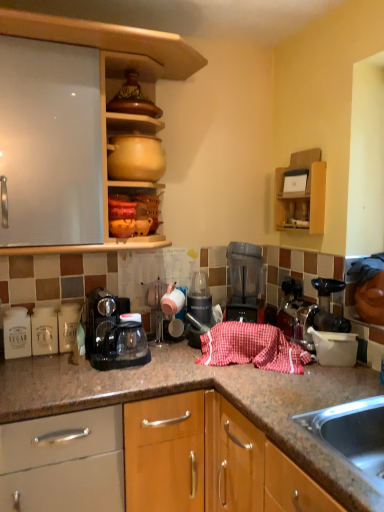
Question: Should I look upward or downward to see black plastic blender at center, the first appliance from the bottom?

Choices:
 (A) up
 (B) down

Answer: (B)

Question: Is the depth of matte yellow clay pot at upper center, which is the 2th appliance in back-to-front order, less than that of red checkered cloth at center?

Choices:
 (A) no
 (B) yes

Answer: (A)

Question: Is matte yellow clay pot at upper center, placed as the 1th appliance when sorted from left to right, thinner than red checkered cloth at center?

Choices:
 (A) no
 (B) yes

Answer: (A)

Question: Can you confirm if matte yellow clay pot at upper center, the first appliance positioned from the top, is positioned to the right of red checkered cloth at center?

Choices:
 (A) no
 (B) yes

Answer: (A)

Question: Does matte yellow clay pot at upper center, the second appliance when ordered from right to left, have a smaller size compared to red checkered cloth at center?

Choices:
 (A) no
 (B) yes

Answer: (B)

Question: Does matte yellow clay pot at upper center, placed as the 1th appliance when sorted from left to right, have a greater height compared to red checkered cloth at center?

Choices:
 (A) yes
 (B) no

Answer: (B)

Question: From the image's perspective, is matte yellow clay pot at upper center, which is counted as the 2th appliance, starting from the bottom, on top of red checkered cloth at center?

Choices:
 (A) no
 (B) yes

Answer: (B)

Question: From a real-world perspective, does matte yellow clay pot at upper center, placed as the 1th appliance when sorted from left to right, stand above black plastic blender at center, the 2th appliance from the top?

Choices:
 (A) yes
 (B) no

Answer: (A)

Question: Considering the relative positions of matte yellow clay pot at upper center, which is counted as the 2th appliance, starting from the bottom, and black plastic blender at center, which ranks as the second appliance in front-to-back order, in the image provided, is matte yellow clay pot at upper center, which is counted as the 2th appliance, starting from the bottom, in front of black plastic blender at center, which ranks as the second appliance in front-to-back order,?

Choices:
 (A) yes
 (B) no

Answer: (A)

Question: Does matte yellow clay pot at upper center, which is the 2th appliance in back-to-front order, come behind black plastic blender at center, arranged as the 2th appliance when viewed from the left?

Choices:
 (A) no
 (B) yes

Answer: (A)

Question: From the image's perspective, does matte yellow clay pot at upper center, the second appliance when ordered from right to left, appear lower than black plastic blender at center, the 2th appliance from the top?

Choices:
 (A) yes
 (B) no

Answer: (B)

Question: From a real-world perspective, is matte yellow clay pot at upper center, which is counted as the 2th appliance, starting from the bottom, physically below black plastic blender at center, the first appliance in the right-to-left sequence?

Choices:
 (A) no
 (B) yes

Answer: (A)

Question: Is matte yellow clay pot at upper center, which is counted as the 2th appliance, starting from the bottom, to the right of black plastic blender at center, arranged as the 2th appliance when viewed from the left, from the viewer's perspective?

Choices:
 (A) no
 (B) yes

Answer: (A)

Question: Is translucent plastic blender at center far away from matte ceramic pots at upper center, the 2th cabinetry from the right?

Choices:
 (A) yes
 (B) no

Answer: (B)